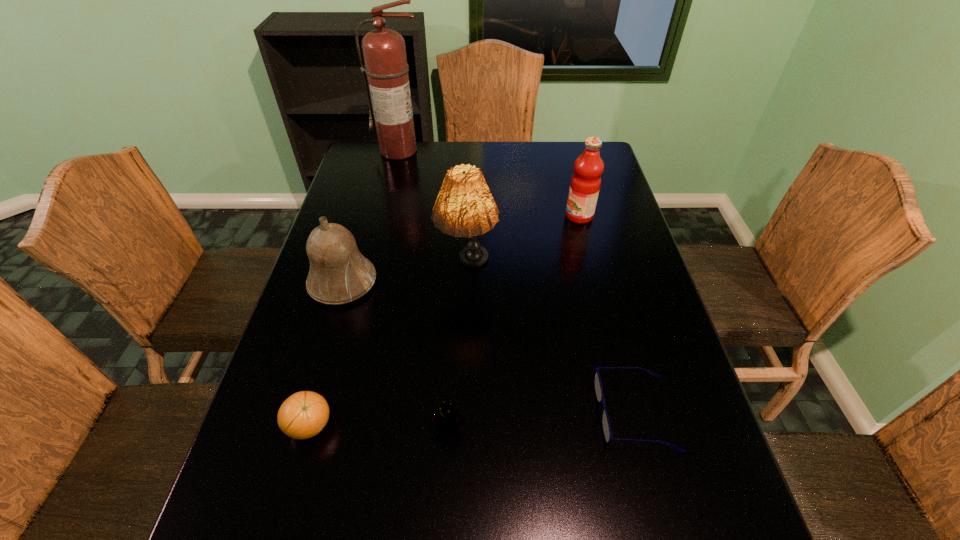
Where is `object positioned at the far edge`? This screenshot has height=540, width=960. object positioned at the far edge is located at coordinates (384, 52).

You are a GUI agent. You are given a task and a screenshot of the screen. Output one action in this format:
    pyautogui.click(x=<x>, y=<y>)
    Task: Click on the fire extinguisher located in the left edge section of the desktop
    The height and width of the screenshot is (540, 960).
    Given the screenshot: What is the action you would take?
    pyautogui.click(x=384, y=52)

In order to click on bell present at the left edge in this screenshot , I will do `click(339, 273)`.

Identify the location of orange positioned at the left edge. (304, 414).

Locate an element on the screen. The height and width of the screenshot is (540, 960). fruit juice positioned at the right edge is located at coordinates 585,183.

Where is `spectacles that is positioned at the right edge`? spectacles that is positioned at the right edge is located at coordinates (605, 422).

Locate an element on the screen. object situated at the far left corner is located at coordinates (384, 52).

Locate an element on the screen. The width and height of the screenshot is (960, 540). free space at the far edge of the desktop is located at coordinates (514, 146).

You are a GUI agent. You are given a task and a screenshot of the screen. Output one action in this format:
    pyautogui.click(x=<x>, y=<y>)
    Task: Click on the vacant space at the left edge
    
    Given the screenshot: What is the action you would take?
    pyautogui.click(x=366, y=208)

In the image, there is a desktop. Identify the location of free space at the right edge. (620, 383).